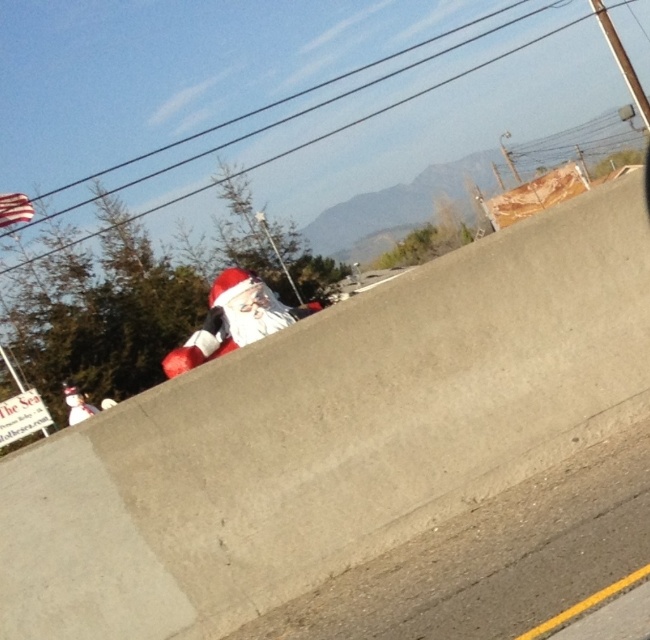
Is point (231, 340) positioned before point (75, 419)?

Yes, point (231, 340) is closer to viewer.

Between fuzzy red santa at center and white plush santa at lower left, which one has less height?

white plush santa at lower left is shorter.

Describe the element at coordinates (234, 320) in the screenshot. I see `fuzzy red santa at center` at that location.

The width and height of the screenshot is (650, 640). I want to click on fuzzy red santa at center, so coord(234,320).